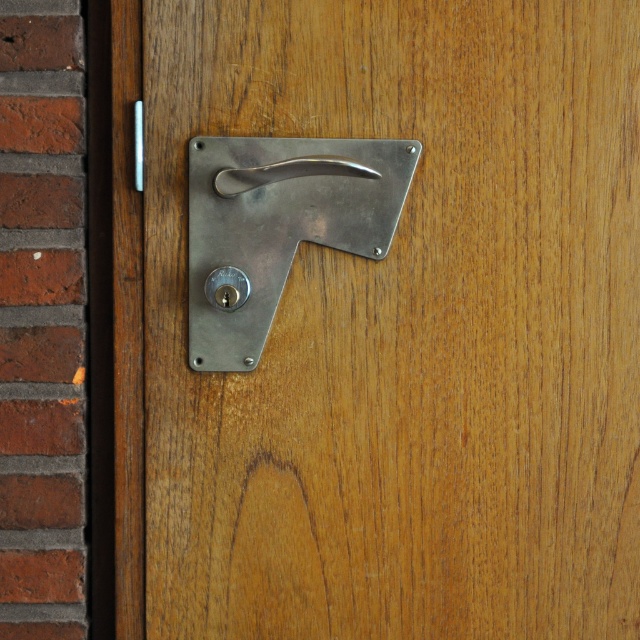
Who is more forward, (205,324) or (240,292)?

→ Point (240,292) is in front.

Does polished metal door handle at center appear on the left side of polished metal latch at upper center?

No, polished metal door handle at center is not to the left of polished metal latch at upper center.

Does point (280, 237) come closer to viewer compared to point (225, 284)?

No, (280, 237) is further to viewer.

Locate an element on the screen. The image size is (640, 640). polished metal door handle at center is located at coordinates (280, 224).

Can you confirm if polished metal door handle at center is positioned below polished silver handle at upper center?

Yes, polished metal door handle at center is below polished silver handle at upper center.

Measure the distance from polished metal door handle at center to polished silver handle at upper center.

polished metal door handle at center and polished silver handle at upper center are 1.23 inches apart.

Does point (292, 182) lie in front of point (273, 173)?

That is False.

Where is `polished metal door handle at center`? The height and width of the screenshot is (640, 640). polished metal door handle at center is located at coordinates (280, 224).

From the picture: Between polished silver handle at upper center and polished metal latch at upper center, which one has more height?

Standing taller between the two is polished silver handle at upper center.

Can you confirm if polished silver handle at upper center is positioned below polished metal latch at upper center?

No.

Is point (221, 173) closer to viewer compared to point (224, 269)?

Yes, point (221, 173) is closer to viewer.

Identify the location of polished silver handle at upper center. (285, 172).